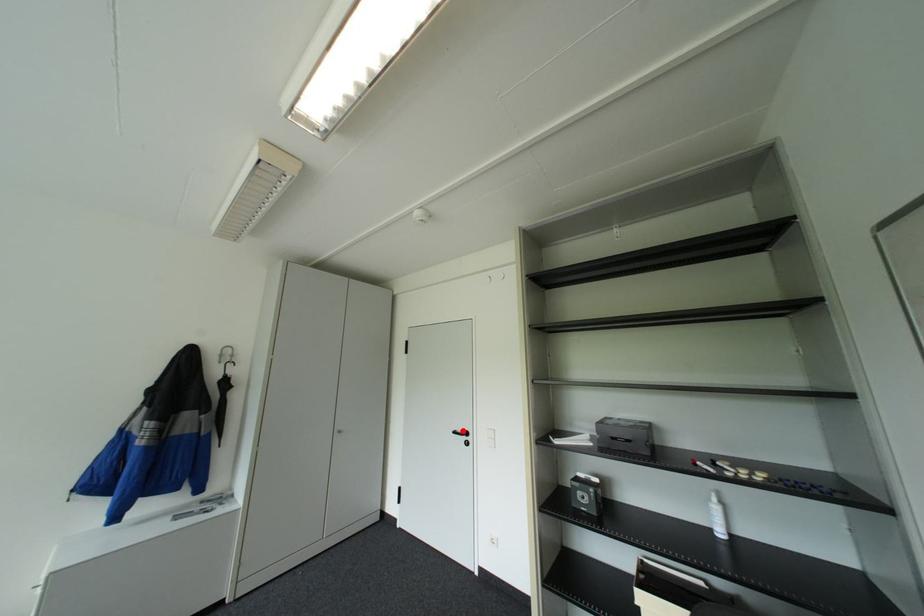
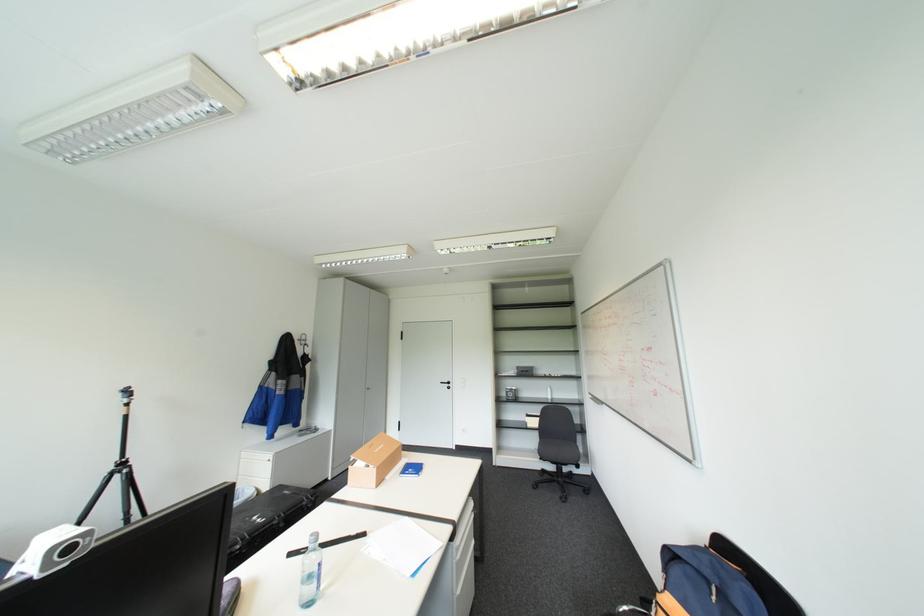
Locate, in the second image, the point that corresponds to the highlighted location in the first image.

(450, 381)